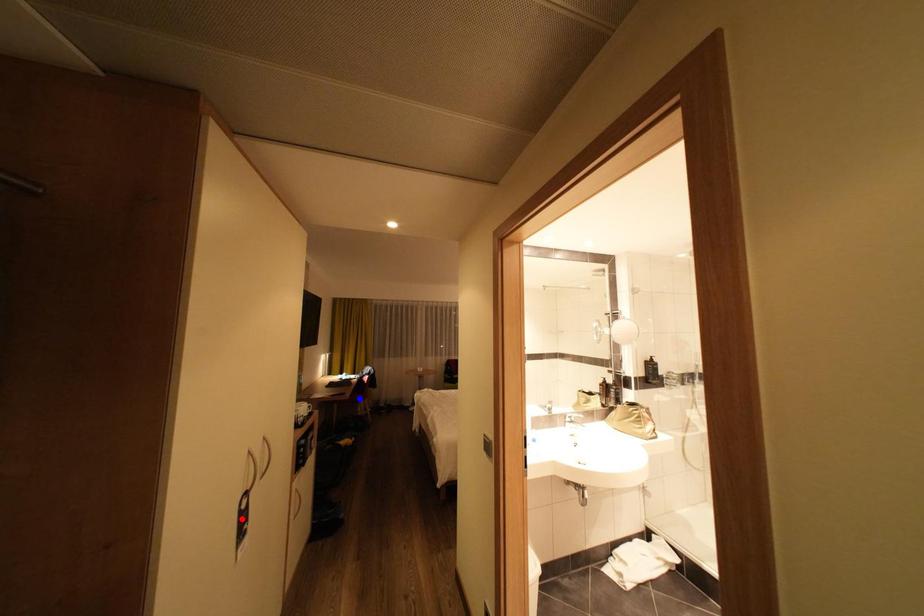
Question: In the image, two points are highlighted. Which point is nearer to the camera? Reply with the corresponding letter.

Choices:
 (A) blue point
 (B) red point

Answer: (B)